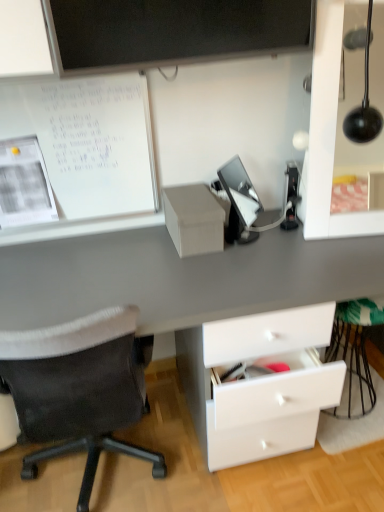
Find the location of a particular element. The image size is (384, 512). white matte paperboard at upper left is located at coordinates (88, 142).

Identify the location of matte cardboard box at center. (194, 219).

What do you see at coordinates (336, 128) in the screenshot? I see `matte black lamp at upper right` at bounding box center [336, 128].

At what (x,y) coordinates should I click in order to perform the action: click on white matte paperboard at upper left. Please return your answer as a coordinate pair (x, y). The image size is (384, 512). Looking at the image, I should click on (88, 142).

Are white matte paperboard at upper left and matte cardboard box at center beside each other?

There is a gap between white matte paperboard at upper left and matte cardboard box at center.

How far apart are white matte paperboard at upper left and matte cardboard box at center?

They are 12.33 inches apart.

From their relative heights in the image, would you say white matte paperboard at upper left is taller or shorter than matte cardboard box at center?

Considering their sizes, white matte paperboard at upper left has more height than matte cardboard box at center.

Considering the relative sizes of black fabric chair at left and matte black lamp at upper right in the image provided, is black fabric chair at left smaller than matte black lamp at upper right?

Incorrect, black fabric chair at left is not smaller in size than matte black lamp at upper right.

Could you tell me if black fabric chair at left is turned towards matte black lamp at upper right?

No, black fabric chair at left is not aimed at matte black lamp at upper right.

From the image's perspective, is black fabric chair at left located above or below matte black lamp at upper right?

Based on their image positions, black fabric chair at left is located beneath matte black lamp at upper right.

Considering the positions of objects black fabric chair at left and matte black lamp at upper right in the image provided, who is in front, black fabric chair at left or matte black lamp at upper right?

black fabric chair at left.

Between point (48, 349) and point (220, 231), which one is positioned in front?

The point (48, 349) is more forward.

Looking at this image, which object is thinner, black fabric chair at left or matte cardboard box at center?

Thinner between the two is matte cardboard box at center.

From a real-world perspective, which is physically above, black fabric chair at left or matte cardboard box at center?

In real-world perspective, matte cardboard box at center is above.

Based on the photo, can you tell me how much black fabric chair at left and matte cardboard box at center differ in facing direction?

The angle between the facing direction of black fabric chair at left and the facing direction of matte cardboard box at center is 178 degrees.

In the scene shown: From the image's perspective, which one is positioned lower, matte black lamp at upper right or black fabric chair at left?

black fabric chair at left is shown below in the image.

Between matte black lamp at upper right and black fabric chair at left, which one has larger width?

With larger width is black fabric chair at left.

Looking at this image, does matte black lamp at upper right contain black fabric chair at left?

Actually, black fabric chair at left is outside matte black lamp at upper right.

Is point (325, 197) closer or farther from the camera than point (22, 400)?

Point (325, 197).

Who is bigger, matte cardboard box at center or matte black lamp at upper right?

Bigger between the two is matte black lamp at upper right.

Considering the positions of point (223, 231) and point (370, 150), is point (223, 231) closer or farther from the camera than point (370, 150)?

Point (223, 231).

Between matte cardboard box at center and matte black lamp at upper right, which one has smaller width?

Thinner between the two is matte black lamp at upper right.

Which object is further away from the camera taking this photo, matte cardboard box at center or white matte paperboard at upper left?

Positioned behind is matte cardboard box at center.

From a real-world perspective, is matte cardboard box at center above or below white matte paperboard at upper left?

In terms of real-world spatial position, matte cardboard box at center is below white matte paperboard at upper left.

Is matte cardboard box at center touching white matte paperboard at upper left?

No, matte cardboard box at center is not in contact with white matte paperboard at upper left.

Considering the relative positions of matte cardboard box at center and white matte paperboard at upper left in the image provided, is matte cardboard box at center to the left of white matte paperboard at upper left from the viewer's perspective?

No.

Who is more distant, matte black lamp at upper right or matte cardboard box at center?

matte cardboard box at center is more distant.

Could you tell me if matte black lamp at upper right is facing matte cardboard box at center?

No.

Who is shorter, matte black lamp at upper right or matte cardboard box at center?

With less height is matte cardboard box at center.

How many degrees apart are the facing directions of matte black lamp at upper right and matte cardboard box at center?

The facing directions of matte black lamp at upper right and matte cardboard box at center are 5.75 degrees apart.

You are a GUI agent. You are given a task and a screenshot of the screen. Output one action in this format:
    pyautogui.click(x=<x>, y=<y>)
    Task: Click on the bulletin board above the matte cardboard box at center (from a real-world perspective)
    
    Given the screenshot: What is the action you would take?
    pyautogui.click(x=88, y=142)

Identify the location of dresser on the right of black fabric chair at left. (336, 128).

Which object lies further to the anchor point matte cardboard box at center, black fabric chair at left or matte black lamp at upper right?

black fabric chair at left is further to matte cardboard box at center.

Which object lies further to the anchor point black fabric chair at left, white matte paperboard at upper left or matte cardboard box at center?

Among the two, white matte paperboard at upper left is located further to black fabric chair at left.

Based on their spatial positions, is white matte paperboard at upper left or matte black lamp at upper right further from matte cardboard box at center?

Based on the image, matte black lamp at upper right appears to be further to matte cardboard box at center.

Based on their spatial positions, is matte cardboard box at center or matte black lamp at upper right closer to black fabric chair at left?

matte cardboard box at center is closer to black fabric chair at left.

Based on their spatial positions, is white matte paperboard at upper left or matte cardboard box at center further from matte black lamp at upper right?

white matte paperboard at upper left is further to matte black lamp at upper right.

Estimate the real-world distances between objects in this image. Which object is closer to matte black lamp at upper right, matte cardboard box at center or black fabric chair at left?

Among the two, matte cardboard box at center is located nearer to matte black lamp at upper right.

Estimate the real-world distances between objects in this image. Which object is closer to matte cardboard box at center, matte black lamp at upper right or white matte paperboard at upper left?

The object closer to matte cardboard box at center is white matte paperboard at upper left.

Consider the image. Looking at the image, which one is located further to matte cardboard box at center, black fabric chair at left or white matte paperboard at upper left?

The object further to matte cardboard box at center is black fabric chair at left.

At what (x,y) coordinates should I click in order to perform the action: click on shelf between white matte paperboard at upper left and matte black lamp at upper right in the horizontal direction. Please return your answer as a coordinate pair (x, y). This screenshot has height=512, width=384. Looking at the image, I should click on (194, 219).

Where is `chair between white matte paperboard at upper left and matte black lamp at upper right`? chair between white matte paperboard at upper left and matte black lamp at upper right is located at coordinates (80, 389).

Find the location of a particular element. shelf that lies between white matte paperboard at upper left and black fabric chair at left from top to bottom is located at coordinates coord(194,219).

This screenshot has width=384, height=512. What are the coordinates of `shelf between black fabric chair at left and matte black lamp at upper right` in the screenshot? It's located at (x=194, y=219).